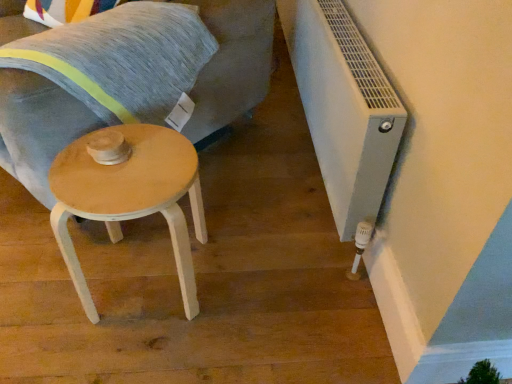
This screenshot has width=512, height=384. What are the coordinates of `vacant region to the left of light wood/wooden stool at lower left` in the screenshot? It's located at (42, 294).